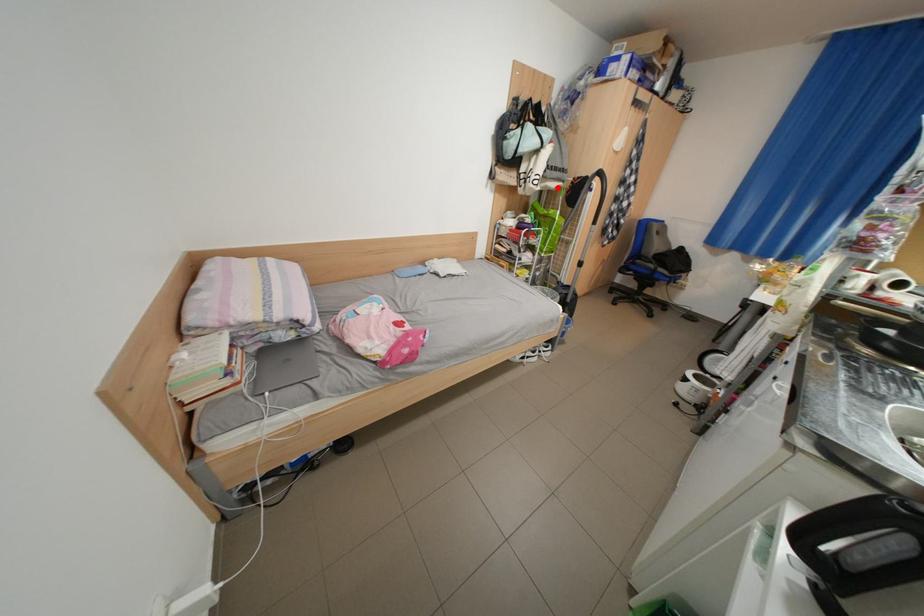
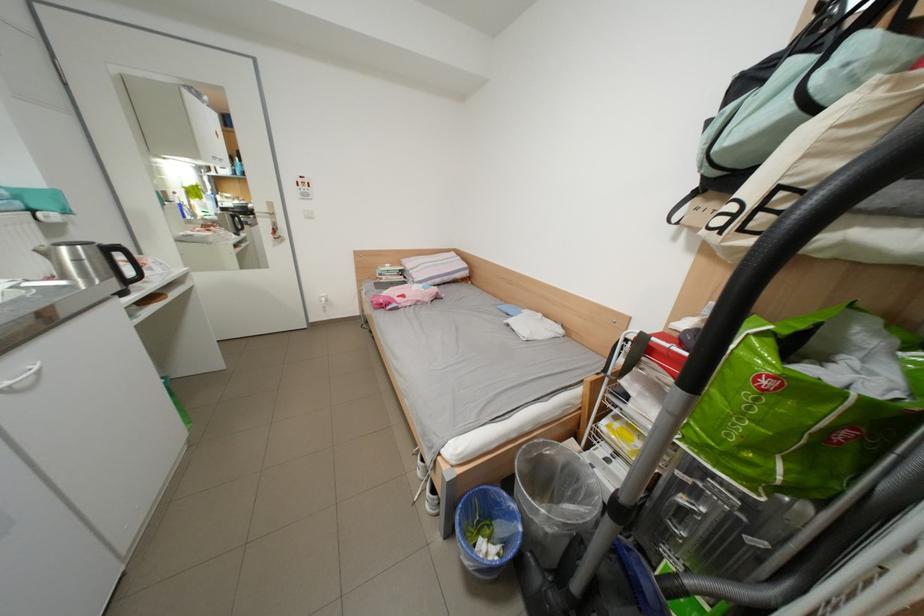
Question: A red point is marked in image1. In image2, is the corresponding 3D point closer to the camera or farther? Reply with the corresponding letter.

Choices:
 (A) The corresponding 3D point is closer.
 (B) The corresponding 3D point is farther.

Answer: (B)